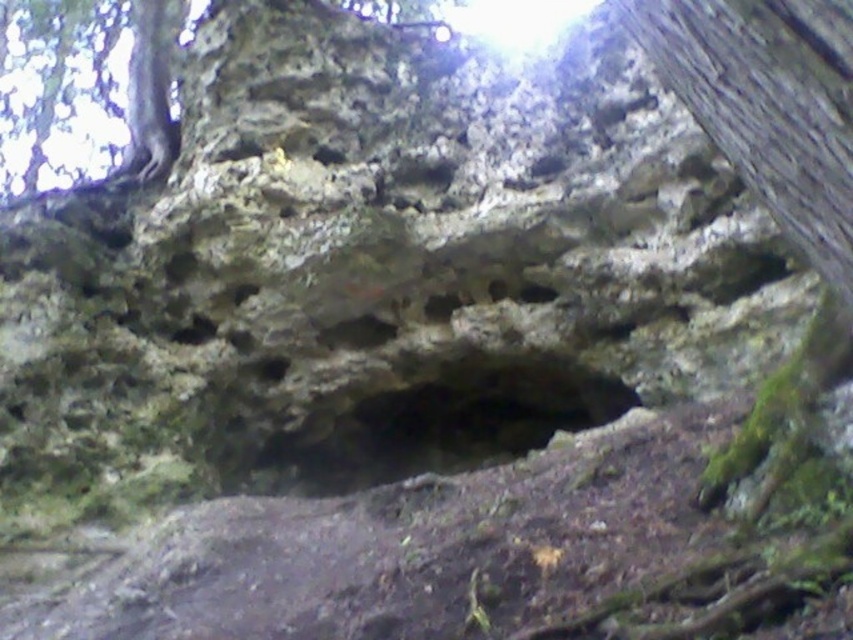
You are a hiker who wants to take a selfie with the smooth bark tree trunk at upper right. You have a smartphone with a standard 0.5 meter selfie distance. Can you take the selfie without moving closer than 0.5 meters?

The smooth bark tree trunk at upper right is 1.13 meters away from the camera, so yes, you can take the selfie without moving closer than 0.5 meters since the distance is sufficient.

You are an explorer trying to navigate through the area. You see the smooth bark tree trunk at upper right and the dark rock hole at center. Which object is located to the right side of the other?

The smooth bark tree trunk at upper right is positioned on the right side of dark rock hole at center.